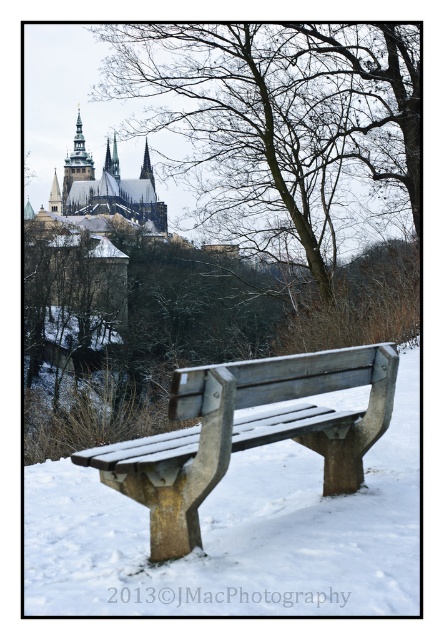
Does bare branches at upper center lie in front of snow-covered stone castle at upper left?

Yes, bare branches at upper center is closer to the viewer.

Who is shorter, bare branches at upper center or snow-covered stone castle at upper left?

snow-covered stone castle at upper left

Identify the location of bare branches at upper center. (280, 124).

How distant is bare branches at upper center from wooden bench at center?

bare branches at upper center and wooden bench at center are 56.05 meters apart from each other.

Does bare branches at upper center have a lesser width compared to wooden bench at center?

In fact, bare branches at upper center might be wider than wooden bench at center.

Between point (341, 198) and point (256, 428), which one is positioned behind?

The point (341, 198) is more distant.

Locate an element on the screen. The width and height of the screenshot is (444, 640). bare branches at upper center is located at coordinates tap(280, 124).

Which is above, wooden bench at center or snow-covered stone castle at upper left?

snow-covered stone castle at upper left is higher up.

Does wooden bench at center have a greater height compared to snow-covered stone castle at upper left?

Incorrect, wooden bench at center's height is not larger of snow-covered stone castle at upper left's.

Who is more forward, (175, 522) or (51, 196)?

Positioned in front is point (175, 522).

Where is `wooden bench at center`? Image resolution: width=444 pixels, height=640 pixels. wooden bench at center is located at coordinates (246, 433).